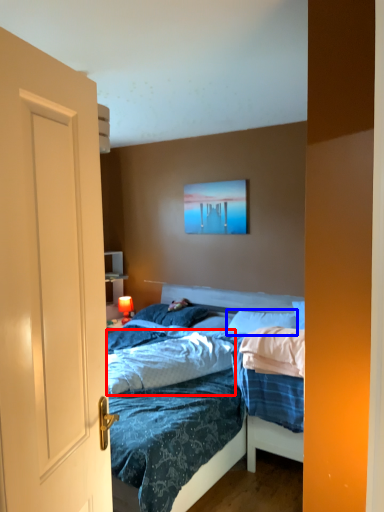
Question: Which object appears farthest to the camera in this image, sheet (highlighted by a red box) or pillow (highlighted by a blue box)?

Choices:
 (A) sheet
 (B) pillow

Answer: (B)